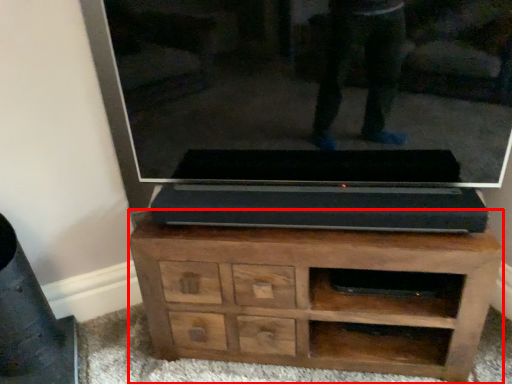
Question: From the image's perspective, where is chest of drawers (annotated by the red box) located in relation to glass door in the image?

Choices:
 (A) above
 (B) below

Answer: (B)